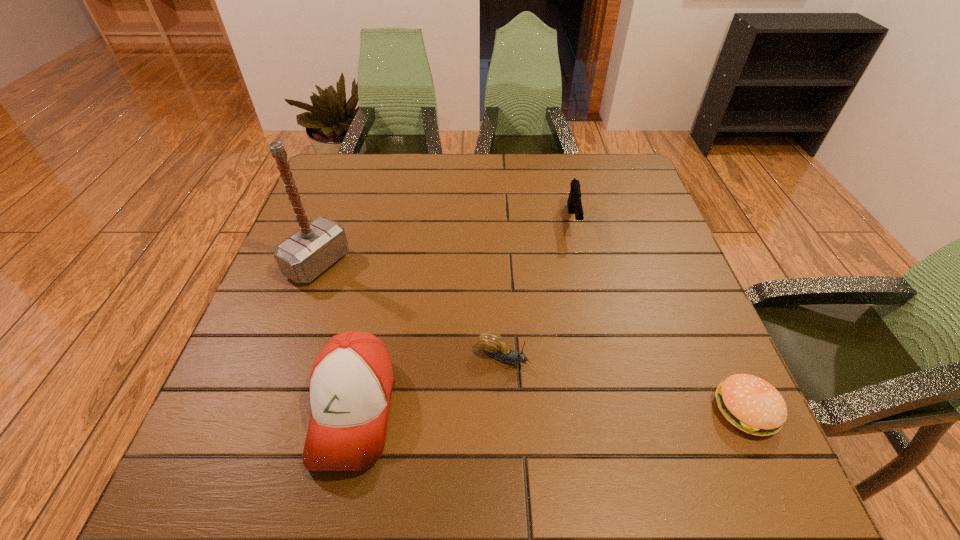
Find the location of `the fourth shortest object`. the fourth shortest object is located at coordinates (351, 383).

I want to click on baseball cap, so click(x=351, y=383).

Identify the location of the rightmost object. The image size is (960, 540). (751, 404).

Where is `the leftmost object`? The width and height of the screenshot is (960, 540). the leftmost object is located at coordinates click(304, 255).

Where is `the tallest object`? the tallest object is located at coordinates (304, 255).

Where is `pistol`? The width and height of the screenshot is (960, 540). pistol is located at coordinates (574, 203).

Where is `the third shortest object`? The width and height of the screenshot is (960, 540). the third shortest object is located at coordinates (574, 203).

Locate an element on the screen. The width and height of the screenshot is (960, 540). the third object from left to right is located at coordinates (491, 342).

You are a GUI agent. You are given a task and a screenshot of the screen. Output one action in this format:
    pyautogui.click(x=<x>, y=<y>)
    Task: Click on the vacant area situated on the back of the patty
    Image resolution: width=960 pixels, height=540 pixels.
    Given the screenshot: What is the action you would take?
    pyautogui.click(x=709, y=332)

At what (x,y) coordinates should I click in order to perform the action: click on free space located 0.350m on the striking surface of the hammer. Please return your answer as a coordinate pair (x, y). Image resolution: width=960 pixels, height=540 pixels. Looking at the image, I should click on (464, 343).